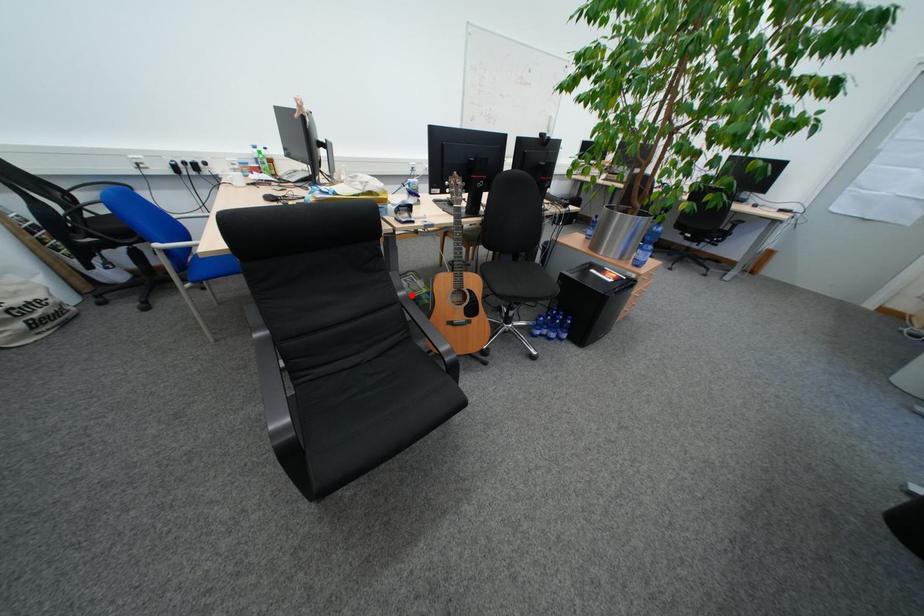
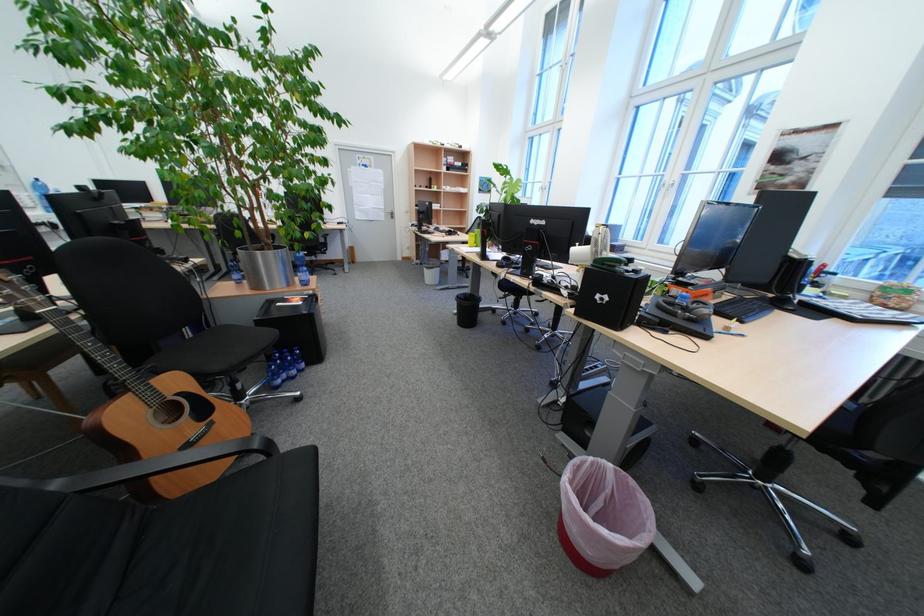
Where in the second image is the point corresponding to the highlighted location from the first image?

(67, 485)